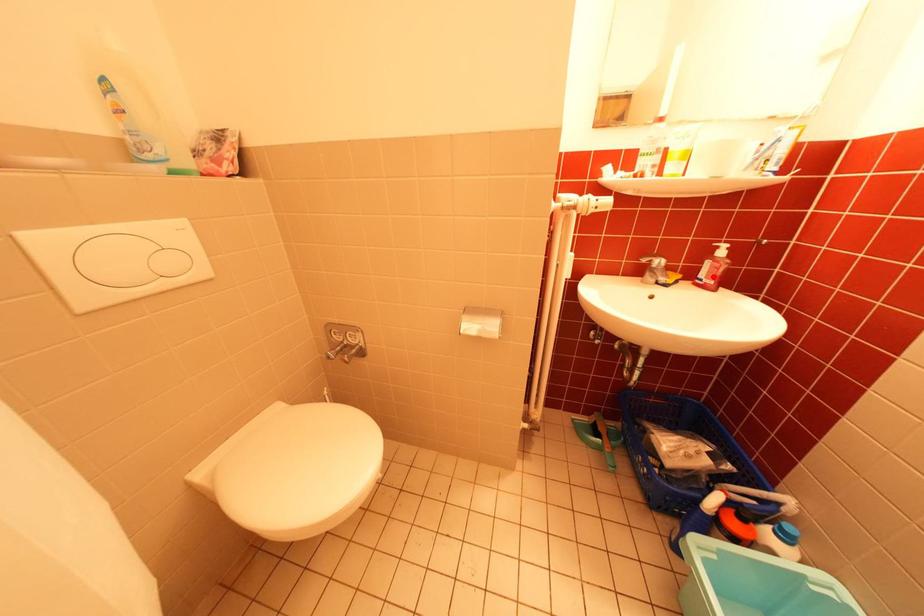
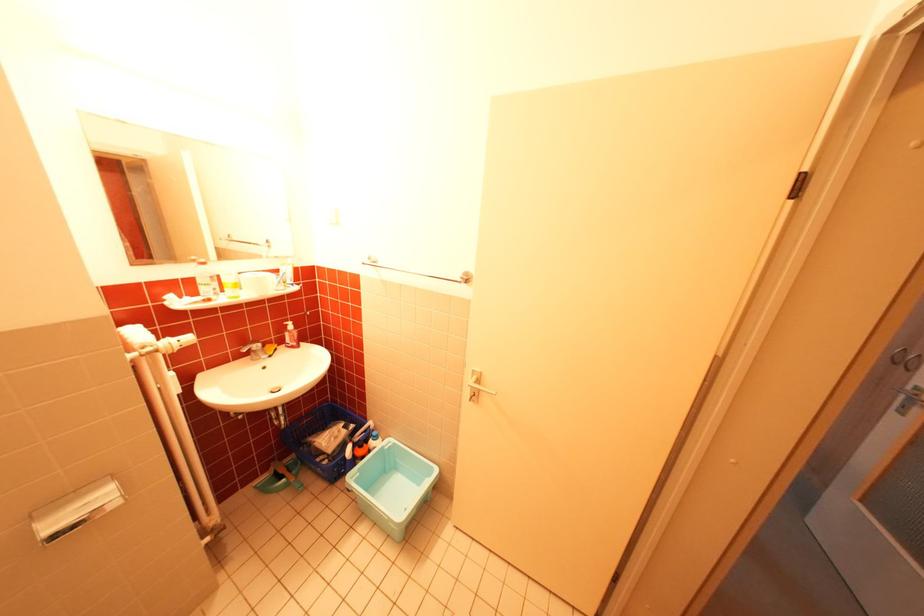
The point at the highlighted location is marked in the first image. Where is the corresponding point in the second image?

(298, 342)